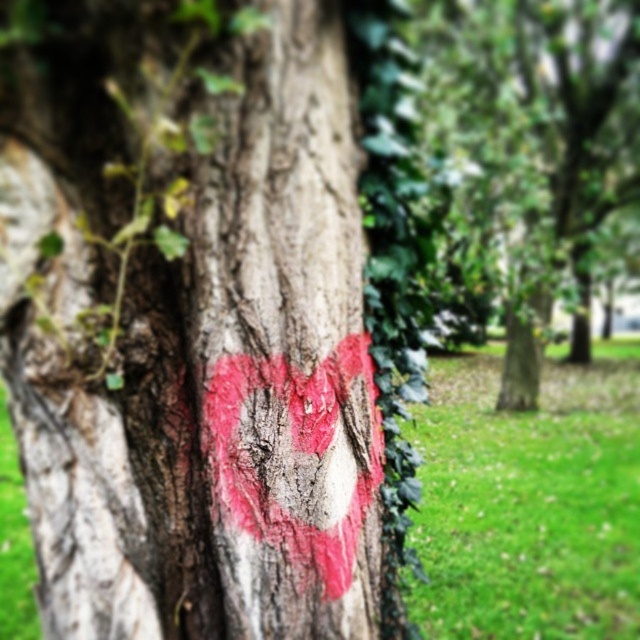
Can you confirm if smooth bark heart at center is positioned above smooth bark tree at center?

No.

Does smooth bark heart at center appear under smooth bark tree at center?

Correct, smooth bark heart at center is located below smooth bark tree at center.

Is point (29, 221) more distant than point (476, 256)?

No, (29, 221) is closer to viewer.

You are a GUI agent. You are given a task and a screenshot of the screen. Output one action in this format:
    pyautogui.click(x=<x>, y=<y>)
    Task: Click on the smooth bark heart at center
    
    Given the screenshot: What is the action you would take?
    pyautogui.click(x=189, y=324)